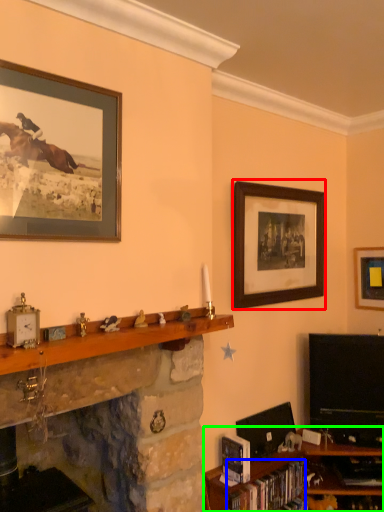
Question: Based on their relative distances, which object is nearer to picture frame (highlighted by a red box)? Choose from book (highlighted by a blue box) and shelf (highlighted by a green box).

Choices:
 (A) book
 (B) shelf

Answer: (B)